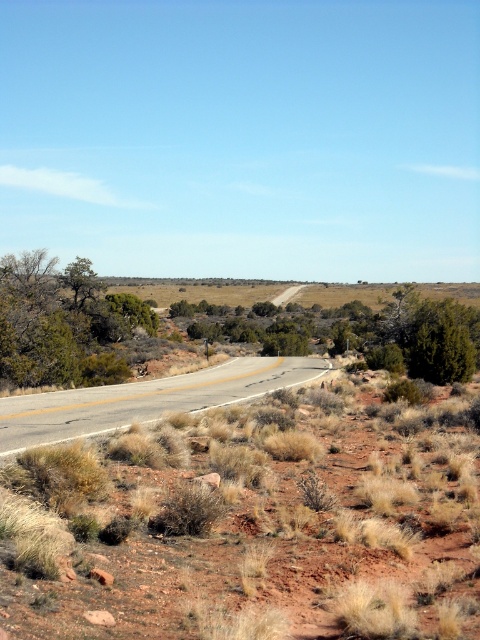
You are standing at the point marked by point (245, 512) in the image. Looking around, you notice the winding road and the sparse vegetation. What is the closest object to your current position?

The closest object to your current position is the dry grass at center represented by point (245, 512).

You are driving along the winding road in the desert landscape and see two points marked on your GPS. The first point is at coordinate point [405,330] and the second is at point [61,429]. According to the map, which point is located further ahead along your driving direction?

Point [405,330] is behind point [61,429], so the point further ahead along your driving direction would be point [61,429].